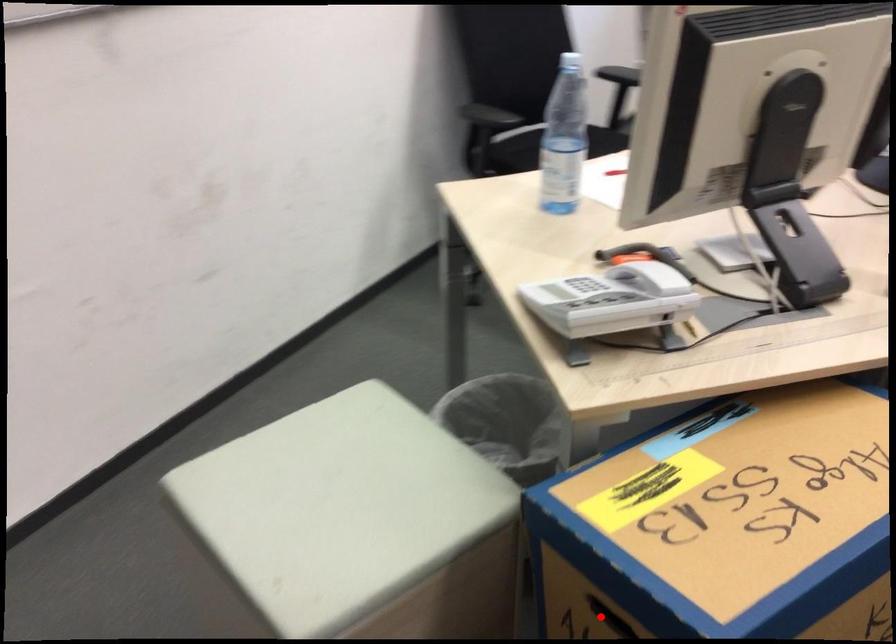
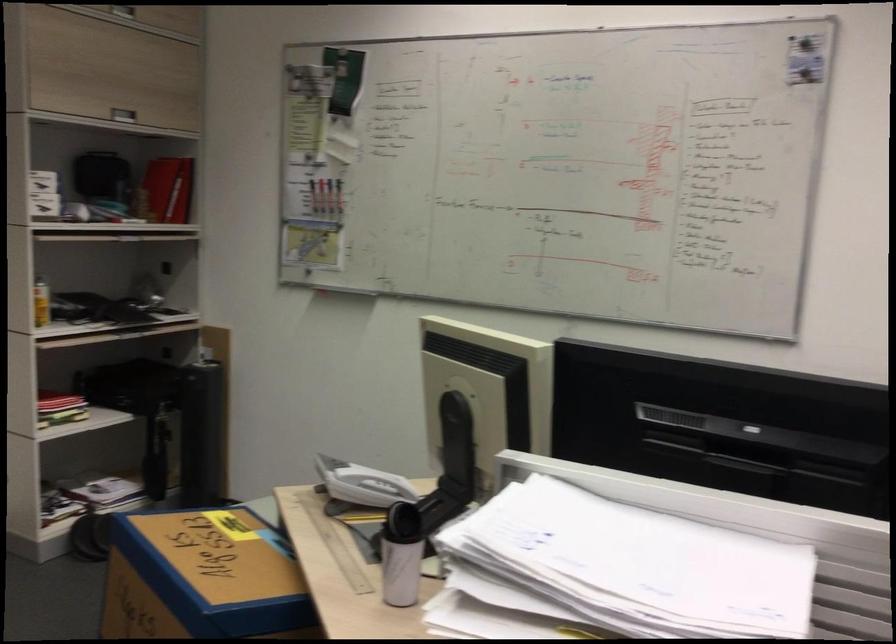
Question: I am providing you with two images of the same scene from different viewpoints. A red point is marked on the first image. Is the red point's position out of view in image 2?

Choices:
 (A) Yes
 (B) No

Answer: (A)